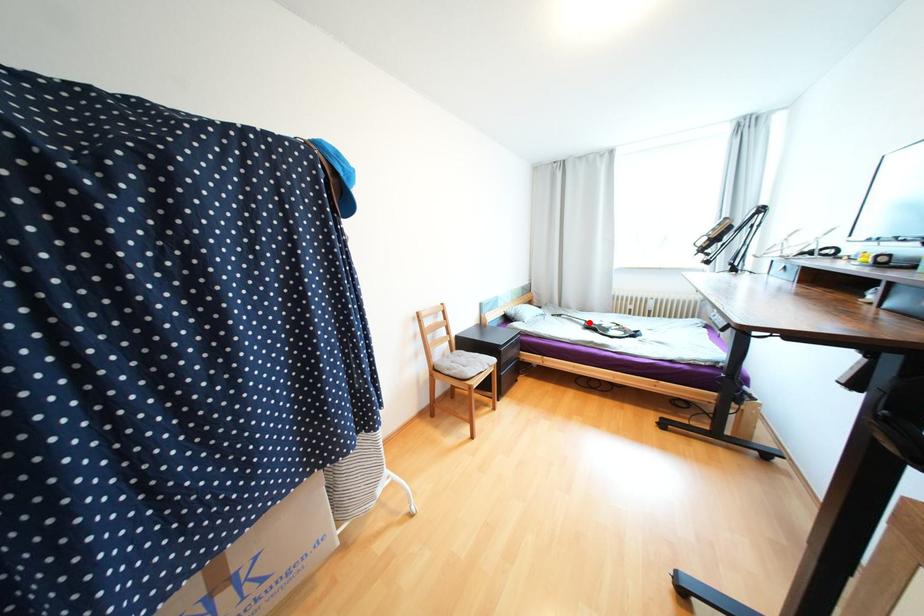
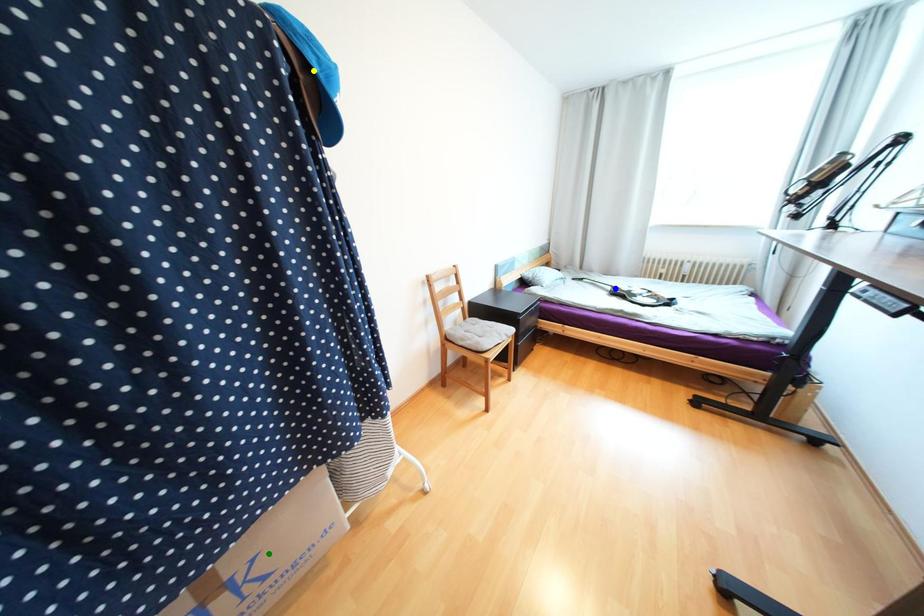
Question: I am providing you with two images of the same scene from different viewpoints. A red point is marked on the first image. You are given multiple points on the second image. Which mark in image 2 goes with the point in image 1?

Choices:
 (A) green point
 (B) blue point
 (C) yellow point

Answer: (B)